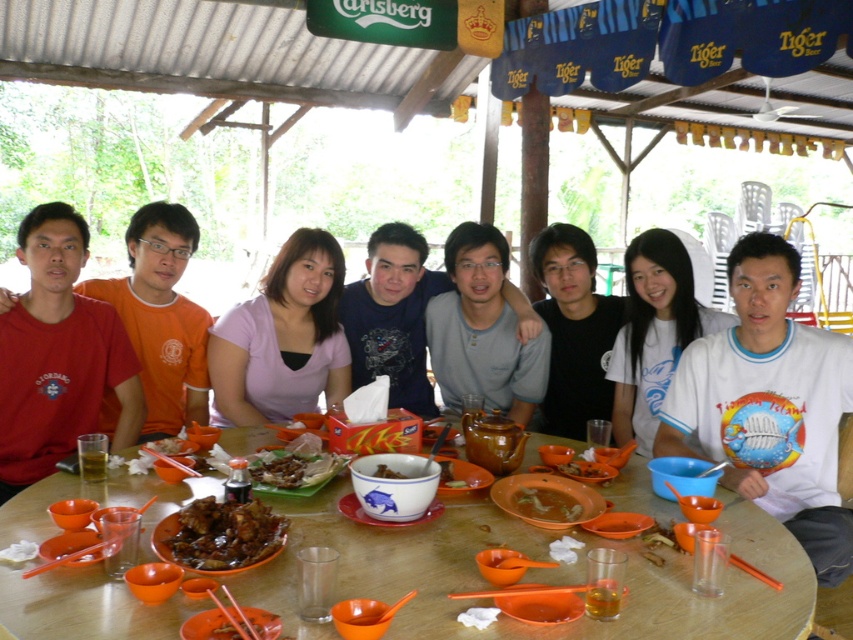
You are a photographer trying to capture a group photo of the people around the table. You notice the matte purple shirt at center and the black matte shirt at center. Which of these two shirts should you ask the wearer to stand up so that the other guests behind them can be seen better?

The matte purple shirt at center is not as tall as the black matte shirt at center, so you should ask the wearer of the matte purple shirt at center to stand up so that the guests behind them can be seen better.

You are a photographer trying to capture a clear shot of the black matte shirt at center and the brown matte chicken at center. Since you want both subjects to be in focus, which one should you adjust your camera focus to prioritize based on their height?

The black matte shirt at center is much taller than the brown matte chicken at center, so you should prioritize focusing on the black matte shirt at center to ensure both are in focus.

You are a photographer taking a picture of the group seated around the round wooden table. You notice the gray matte shirt at center and the brown matte soup bowl at center. Which object is covering the other?

The gray matte shirt at center is positioned over the brown matte soup bowl at center, so the shirt is covering the bowl.